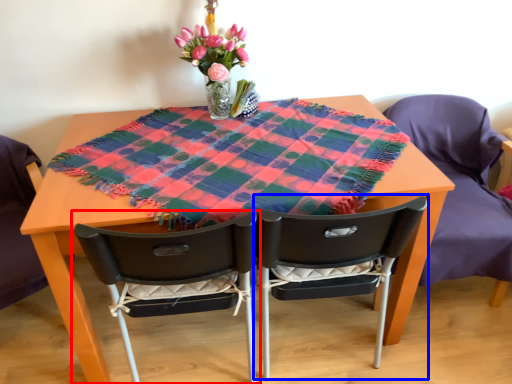
Question: Among these objects, which one is farthest to the camera, chair (highlighted by a red box) or chair (highlighted by a blue box)?

Choices:
 (A) chair
 (B) chair

Answer: (B)